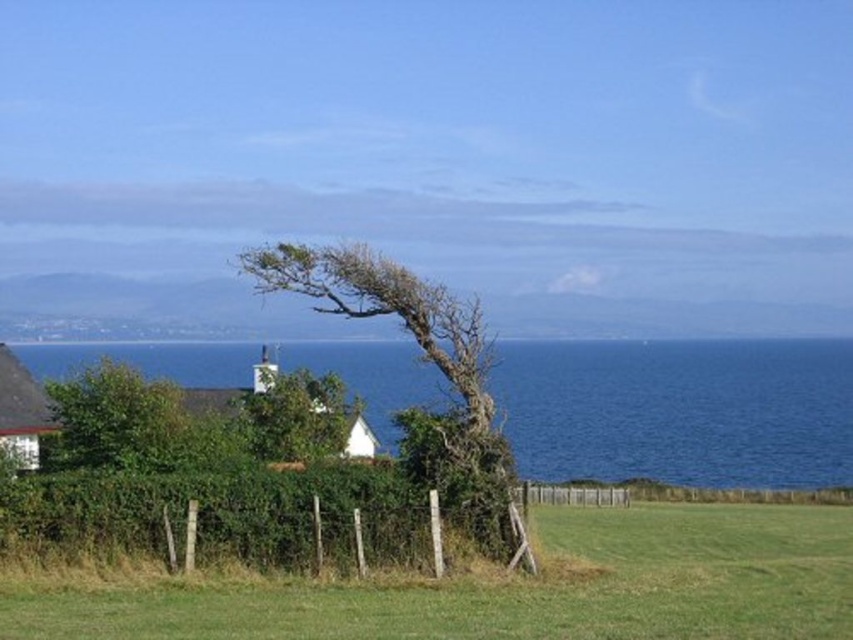
From the picture: You are standing in the coastal landscape scene. You see two points marked in the image. Which point is closer to you? The points are labeled as point 1 at coordinates point (x=161, y=426) and point 2 at coordinates point (x=248, y=396). Please answer based on their positions in the scene.

Point 1 at coordinates point (x=161, y=426) is closer to the viewer than point 2 at coordinates point (x=248, y=396).

You are standing at the point marked by the coordinates point (514, 588) in the image. What is the name of the object you are currently standing on?

The green grass at lower center is located at point (514, 588), so you are standing on the green grass at lower center.